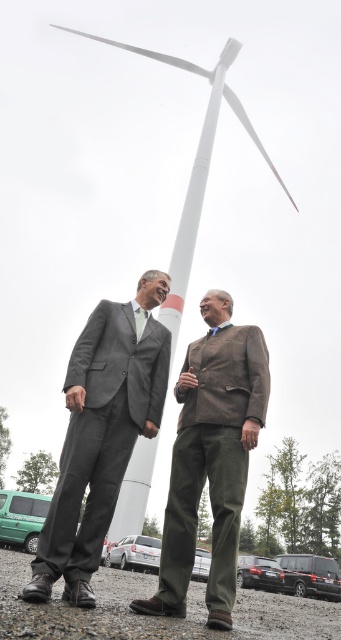
Question: Among these objects, which one is farthest from the camera?

Choices:
 (A) gray suit at center
 (B) brown textured blazer at center

Answer: (B)

Question: Which object is closer to the camera taking this photo?

Choices:
 (A) gray suit at center
 (B) brown textured blazer at center

Answer: (A)

Question: Is gray suit at center below brown textured blazer at center?

Choices:
 (A) yes
 (B) no

Answer: (B)

Question: Which object is farther from the camera taking this photo?

Choices:
 (A) brown textured blazer at center
 (B) gray suit at center

Answer: (A)

Question: Does gray suit at center have a greater width compared to brown textured blazer at center?

Choices:
 (A) yes
 (B) no

Answer: (B)

Question: Does gray suit at center appear under brown textured blazer at center?

Choices:
 (A) yes
 (B) no

Answer: (B)